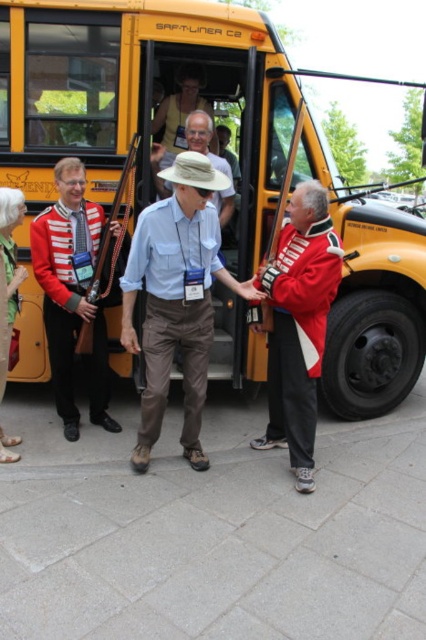
Can you confirm if green fabric dress at lower left is wider than matte khaki hat at center?

No, green fabric dress at lower left is not wider than matte khaki hat at center.

Between point (9, 221) and point (201, 152), which one is positioned behind?

Positioned behind is point (201, 152).

The width and height of the screenshot is (426, 640). Describe the element at coordinates (9, 264) in the screenshot. I see `green fabric dress at lower left` at that location.

This screenshot has height=640, width=426. I want to click on green fabric dress at lower left, so click(x=9, y=264).

Does red wool jacket at center appear under red and white striped uniform at center?

Yes, red wool jacket at center is below red and white striped uniform at center.

Locate an element on the screen. red wool jacket at center is located at coordinates (299, 324).

Image resolution: width=426 pixels, height=640 pixels. What are the coordinates of `red wool jacket at center` in the screenshot? It's located at (299, 324).

How much distance is there between red wool jacket at center and matte khaki hat at center?

4.92 feet

In the scene shown: Is red wool jacket at center bigger than matte khaki hat at center?

Yes.

Is point (273, 378) more distant than point (169, 193)?

No.

The image size is (426, 640). Identify the location of red wool jacket at center. (299, 324).